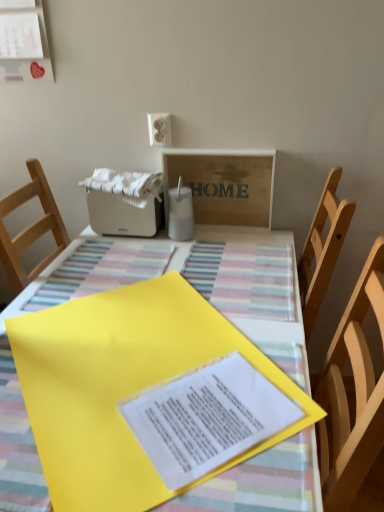
Question: Is matte white paper at upper left not within white plastic toaster at upper center?

Choices:
 (A) yes
 (B) no

Answer: (A)

Question: Is matte white paper at upper left next to white plastic toaster at upper center?

Choices:
 (A) no
 (B) yes

Answer: (A)

Question: From a real-world perspective, does matte white paper at upper left stand above white plastic toaster at upper center?

Choices:
 (A) no
 (B) yes

Answer: (B)

Question: Is matte white paper at upper left thinner than white plastic toaster at upper center?

Choices:
 (A) yes
 (B) no

Answer: (A)

Question: Would you say white plastic toaster at upper center is part of matte white paper at upper left's contents?

Choices:
 (A) yes
 (B) no

Answer: (B)

Question: Does matte white paper at upper left come behind white plastic toaster at upper center?

Choices:
 (A) no
 (B) yes

Answer: (A)

Question: From a real-world perspective, is yellow paper at center positioned over yellow paper at center based on gravity?

Choices:
 (A) yes
 (B) no

Answer: (B)

Question: Does yellow paper at center have a smaller size compared to yellow paper at center?

Choices:
 (A) no
 (B) yes

Answer: (A)

Question: From the image's perspective, is yellow paper at center located above yellow paper at center?

Choices:
 (A) no
 (B) yes

Answer: (A)

Question: Does yellow paper at center have a lesser height compared to yellow paper at center?

Choices:
 (A) no
 (B) yes

Answer: (A)

Question: Does yellow paper at center come in front of yellow paper at center?

Choices:
 (A) yes
 (B) no

Answer: (A)

Question: Would you say yellow paper at center is outside yellow paper at center?

Choices:
 (A) yes
 (B) no

Answer: (A)

Question: Does yellow paper at center have a smaller size compared to yellow paper at center?

Choices:
 (A) no
 (B) yes

Answer: (B)